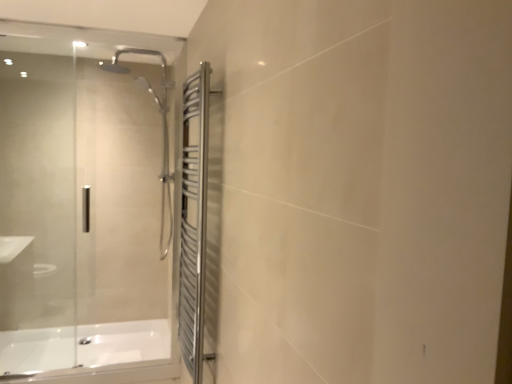
The image size is (512, 384). What are the coordinates of `transparent glass door at left` in the screenshot? It's located at (83, 206).

Find the location of a particular element. The height and width of the screenshot is (384, 512). white glossy bathtub at lower left is located at coordinates (89, 352).

This screenshot has height=384, width=512. In order to click on transparent glass door at left in this screenshot , I will do `click(83, 206)`.

How many degrees apart are the facing directions of polished stainless steel towel rack at right and transparent glass door at left?

The angular difference between polished stainless steel towel rack at right and transparent glass door at left is 90.4 degrees.

Is the surface of polished stainless steel towel rack at right in direct contact with transparent glass door at left?

There is a gap between polished stainless steel towel rack at right and transparent glass door at left.

Looking at the image, does polished stainless steel towel rack at right seem bigger or smaller compared to transparent glass door at left?

In the image, polished stainless steel towel rack at right appears to be smaller than transparent glass door at left.

Is polished stainless steel towel rack at right not within transparent glass door at left?

Yes.

Which is behind, transparent glass door at left or polished stainless steel towel rack at right?

transparent glass door at left is more distant.

Are transparent glass door at left and polished stainless steel towel rack at right located far from each other?

transparent glass door at left is positioned a significant distance from polished stainless steel towel rack at right.

Is polished stainless steel towel rack at right completely or partially inside transparent glass door at left?

No, polished stainless steel towel rack at right is not surrounded by transparent glass door at left.

Which of these two, transparent glass door at left or polished stainless steel towel rack at right, is smaller?

Smaller between the two is polished stainless steel towel rack at right.

Is white glossy bathtub at lower left not close to polished stainless steel towel rack at right?

Yes.

Could polished stainless steel towel rack at right be considered to be inside white glossy bathtub at lower left?

No, white glossy bathtub at lower left does not contain polished stainless steel towel rack at right.

From the image's perspective, is white glossy bathtub at lower left located above polished stainless steel towel rack at right?

No.

Who is more distant, white glossy bathtub at lower left or polished stainless steel towel rack at right?

white glossy bathtub at lower left is further from the camera.

Can you see white glossy bathtub at lower left touching transparent glass door at left?

No.

Is white glossy bathtub at lower left facing away from transparent glass door at left?

No, white glossy bathtub at lower left is not facing away from transparent glass door at left.

From the image's perspective, is white glossy bathtub at lower left located above or below transparent glass door at left?

white glossy bathtub at lower left is below transparent glass door at left.

Is polished stainless steel towel rack at right oriented away from white glossy bathtub at lower left?

No, polished stainless steel towel rack at right is not facing away from white glossy bathtub at lower left.

Can you tell me how much polished stainless steel towel rack at right and white glossy bathtub at lower left differ in facing direction?

polished stainless steel towel rack at right and white glossy bathtub at lower left are facing 89.4 degrees away from each other.

Who is smaller, polished stainless steel towel rack at right or white glossy bathtub at lower left?

Smaller between the two is polished stainless steel towel rack at right.

Are polished stainless steel towel rack at right and white glossy bathtub at lower left located far from each other?

Indeed, polished stainless steel towel rack at right is not near white glossy bathtub at lower left.

Considering the relative sizes of transparent glass door at left and white glossy bathtub at lower left in the image provided, is transparent glass door at left smaller than white glossy bathtub at lower left?

No.

Looking at their sizes, would you say transparent glass door at left is wider or thinner than white glossy bathtub at lower left?

Considering their sizes, transparent glass door at left looks slimmer than white glossy bathtub at lower left.

Does transparent glass door at left turn towards white glossy bathtub at lower left?

No.

How far apart are transparent glass door at left and white glossy bathtub at lower left?

The distance of transparent glass door at left from white glossy bathtub at lower left is 16.33 inches.

Identify the location of screen door lying on the right of transparent glass door at left. Image resolution: width=512 pixels, height=384 pixels. (194, 220).

At what (x,y) coordinates should I click in order to perform the action: click on screen door in front of the transparent glass door at left. Please return your answer as a coordinate pair (x, y). Looking at the image, I should click on (194, 220).

Based on their spatial positions, is transparent glass door at left or polished stainless steel towel rack at right closer to white glossy bathtub at lower left?

The object closer to white glossy bathtub at lower left is transparent glass door at left.

Looking at the image, which one is located closer to white glossy bathtub at lower left, polished stainless steel towel rack at right or transparent glass door at left?

transparent glass door at left.

Consider the image. Based on their spatial positions, is transparent glass door at left or white glossy bathtub at lower left closer to polished stainless steel towel rack at right?

white glossy bathtub at lower left.

Which object lies nearer to the anchor point polished stainless steel towel rack at right, white glossy bathtub at lower left or transparent glass door at left?

white glossy bathtub at lower left is closer to polished stainless steel towel rack at right.

When comparing their distances from transparent glass door at left, does white glossy bathtub at lower left or polished stainless steel towel rack at right seem further?

polished stainless steel towel rack at right lies further to transparent glass door at left than the other object.

From the image, which object appears to be farther from transparent glass door at left, polished stainless steel towel rack at right or white glossy bathtub at lower left?

polished stainless steel towel rack at right is positioned further to the anchor transparent glass door at left.

At what (x,y) coordinates should I click in order to perform the action: click on screen door between transparent glass door at left and white glossy bathtub at lower left vertically. Please return your answer as a coordinate pair (x, y). Looking at the image, I should click on (194, 220).